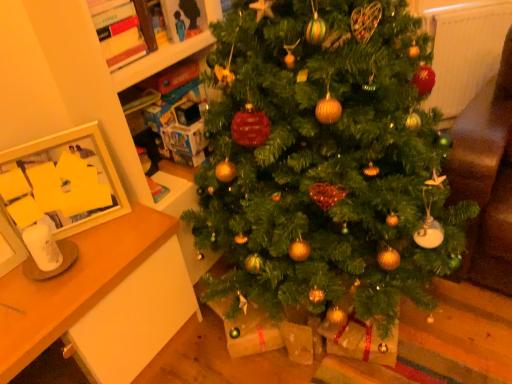
Question: From the image's perspective, is white glossy picture frame at left under green matte christmas tree at center?

Choices:
 (A) no
 (B) yes

Answer: (B)

Question: Can you confirm if white glossy picture frame at left is bigger than green matte christmas tree at center?

Choices:
 (A) yes
 (B) no

Answer: (B)

Question: Is white glossy picture frame at left outside green matte christmas tree at center?

Choices:
 (A) no
 (B) yes

Answer: (B)

Question: Is there a large distance between white glossy picture frame at left and green matte christmas tree at center?

Choices:
 (A) yes
 (B) no

Answer: (B)

Question: Is white glossy picture frame at left in contact with green matte christmas tree at center?

Choices:
 (A) no
 (B) yes

Answer: (A)

Question: Is wooden desk at left taller or shorter than white textured radiator at upper right?

Choices:
 (A) short
 (B) tall

Answer: (B)

Question: Relative to white textured radiator at upper right, is wooden desk at left in front or behind?

Choices:
 (A) front
 (B) behind

Answer: (A)

Question: In terms of width, does wooden desk at left look wider or thinner when compared to white textured radiator at upper right?

Choices:
 (A) thin
 (B) wide

Answer: (B)

Question: Looking at the image, does wooden desk at left seem bigger or smaller compared to white textured radiator at upper right?

Choices:
 (A) big
 (B) small

Answer: (A)

Question: Is point (219, 1) positioned closer to the camera than point (502, 3)?

Choices:
 (A) farther
 (B) closer

Answer: (B)

Question: From their relative heights in the image, would you say cardboard boxes at upper left is taller or shorter than white textured radiator at upper right?

Choices:
 (A) short
 (B) tall

Answer: (A)

Question: Is cardboard boxes at upper left to the left or to the right of white textured radiator at upper right in the image?

Choices:
 (A) left
 (B) right

Answer: (A)

Question: In the image, is cardboard boxes at upper left positioned in front of or behind white textured radiator at upper right?

Choices:
 (A) front
 (B) behind

Answer: (A)

Question: In terms of height, does green matte christmas tree at center look taller or shorter compared to wooden desk at left?

Choices:
 (A) tall
 (B) short

Answer: (A)

Question: Considering the positions of green matte christmas tree at center and wooden desk at left in the image, is green matte christmas tree at center wider or thinner than wooden desk at left?

Choices:
 (A) wide
 (B) thin

Answer: (A)